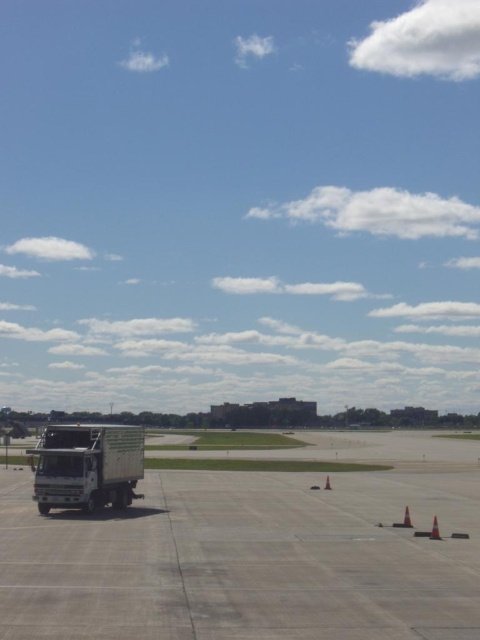
Can you confirm if orange reflective cone at lower right is bigger than orange cone at lower right?

Yes.

Is orange reflective cone at lower right positioned in front of orange cone at lower right?

No, it is behind orange cone at lower right.

Identify the location of orange reflective cone at lower right. Image resolution: width=480 pixels, height=640 pixels. (404, 518).

Can you confirm if orange reflective cone at lower right is positioned to the left of orange matte cone at lower center?

In fact, orange reflective cone at lower right is to the right of orange matte cone at lower center.

How far apart are orange reflective cone at lower right and orange matte cone at lower center?

They are 28.47 feet apart.

This screenshot has width=480, height=640. What do you see at coordinates (404, 518) in the screenshot?
I see `orange reflective cone at lower right` at bounding box center [404, 518].

The image size is (480, 640). What are the coordinates of `orange reflective cone at lower right` in the screenshot? It's located at tap(404, 518).

Who is more distant from viewer, (40, 500) or (406, 513)?

Point (40, 500)

Is white glossy truck at lower left to the right of orange reflective cone at lower right from the viewer's perspective?

No, white glossy truck at lower left is not to the right of orange reflective cone at lower right.

Which is behind, point (51, 442) or point (408, 516)?

The point (51, 442) is more distant.

Locate an element on the screen. This screenshot has width=480, height=640. white glossy truck at lower left is located at coordinates (86, 465).